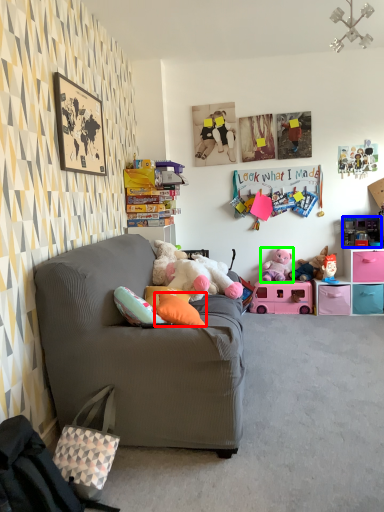
Question: Which object is positioned farthest from pillow (highlighted by a red box)? Select from toy (highlighted by a blue box) and toy (highlighted by a green box).

Choices:
 (A) toy
 (B) toy

Answer: (A)